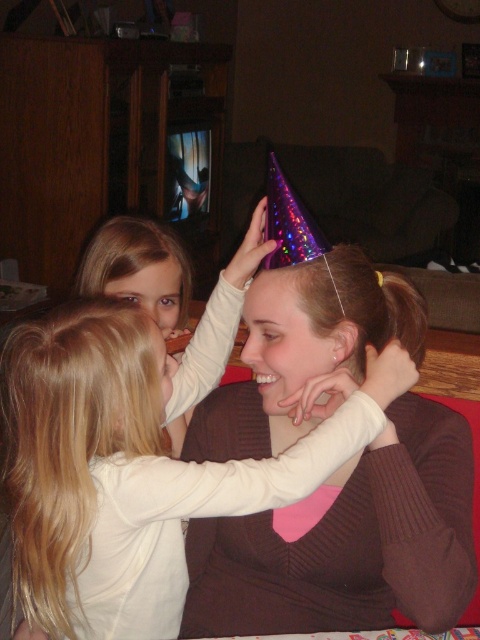
Question: Is purple shiny party hat at upper center positioned in front of blonde hair at upper left?

Choices:
 (A) yes
 (B) no

Answer: (A)

Question: Among these points, which one is farthest from the camera?

Choices:
 (A) (131, 296)
 (B) (371, 314)

Answer: (A)

Question: Which of these objects is positioned farthest from the purple shiny party hat at upper center?

Choices:
 (A) blonde hair at center
 (B) matte white shirt at center
 (C) blonde hair at upper left

Answer: (C)

Question: Can you confirm if purple shiny party hat at upper center is positioned below matte white shirt at center?

Choices:
 (A) no
 (B) yes

Answer: (B)

Question: Among these points, which one is nearest to the camera?

Choices:
 (A) (158, 320)
 (B) (111, 365)
 (C) (54, 420)

Answer: (B)

Question: Is matte white shirt at center wider than blonde hair at upper left?

Choices:
 (A) no
 (B) yes

Answer: (B)